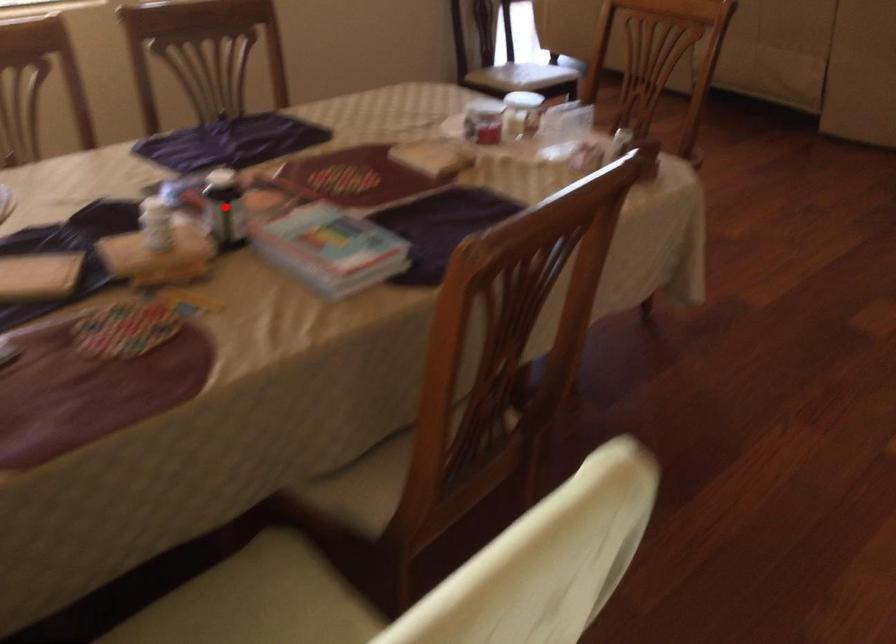
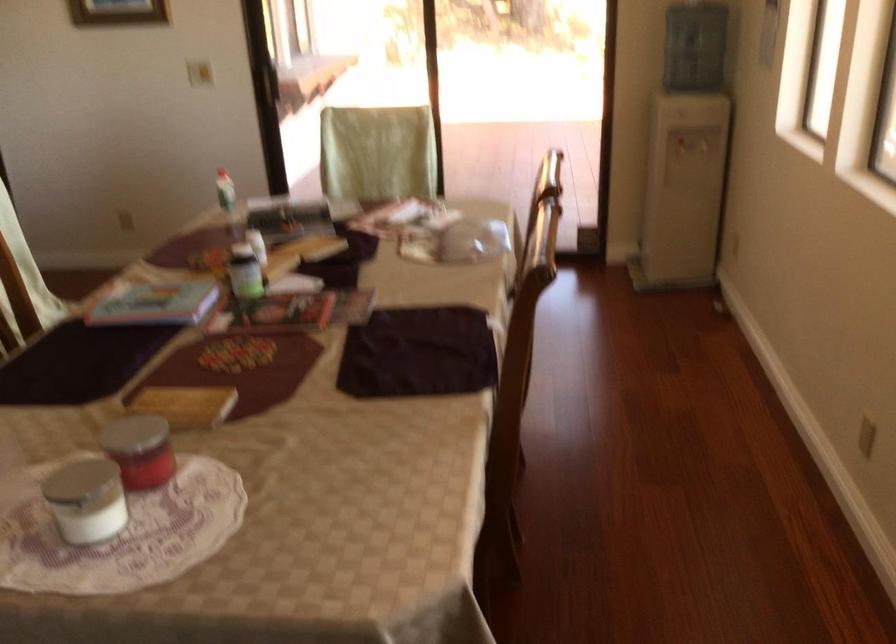
In the second image, find the point that corresponds to the highlighted location in the first image.

(245, 272)